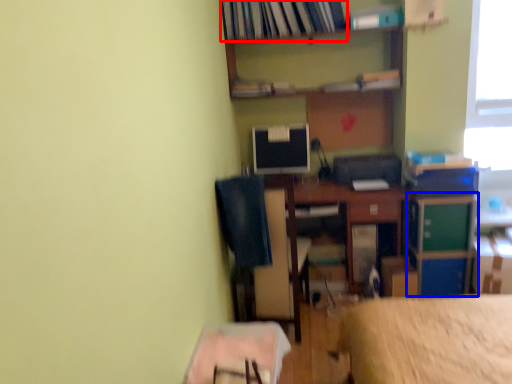
Question: Which point is closer to the camera, book (highlighted by a red box) or file cabinet (highlighted by a blue box)?

Choices:
 (A) book
 (B) file cabinet

Answer: (B)